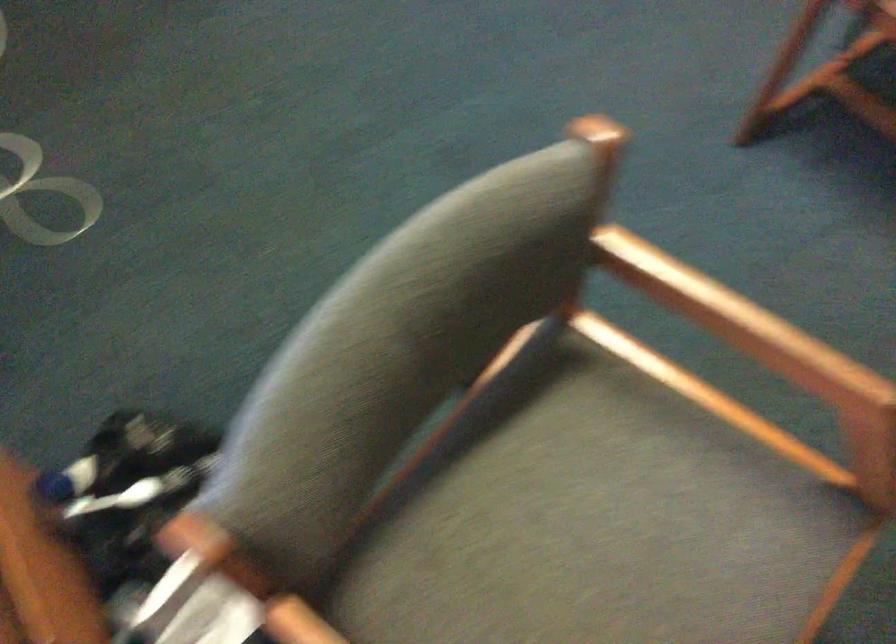
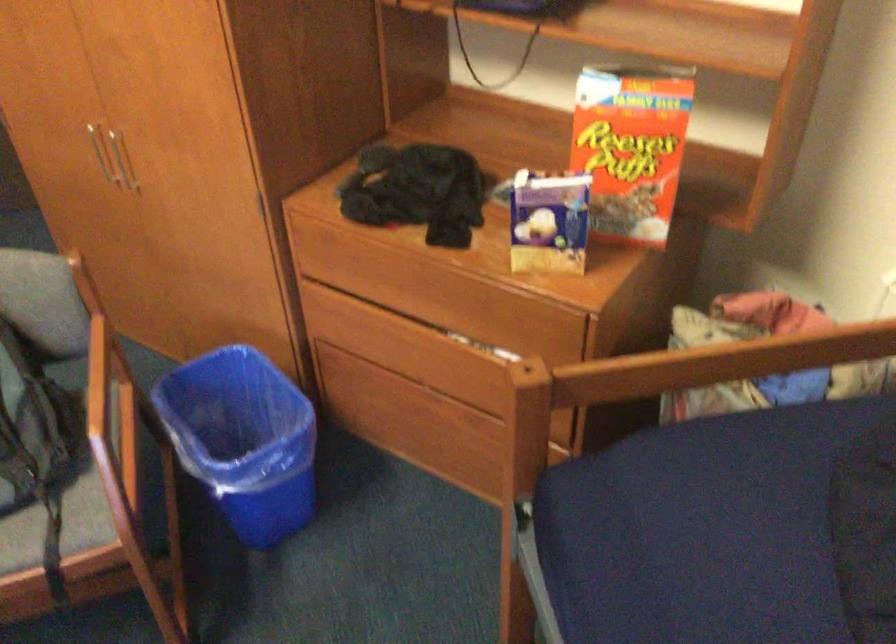
Question: The camera is either moving clockwise (left) or counter-clockwise (right) around the object. The first image is from the beginning of the video and the second image is from the end. Is the camera moving left or right when shooting the video?

Choices:
 (A) Left
 (B) Right

Answer: (A)